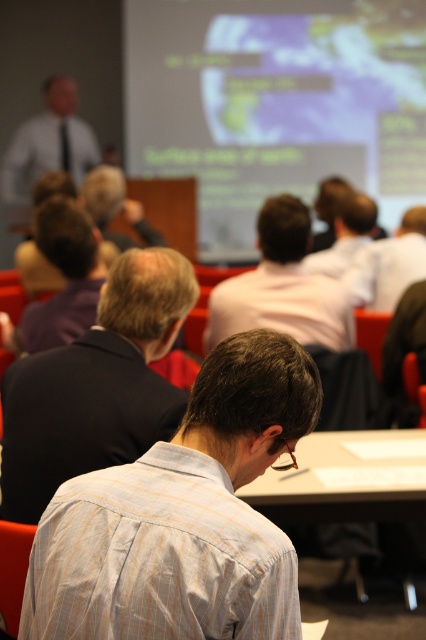
Question: Can you confirm if light blue striped shirt at center is thinner than white shirt at left?

Choices:
 (A) no
 (B) yes

Answer: (B)

Question: Estimate the real-world distances between objects in this image. Which object is closer to the light brown shirt at center?

Choices:
 (A) matte purple shirt at left
 (B) matte projector screen at upper center

Answer: (A)

Question: Which object is the farthest from the white shirt at upper center?

Choices:
 (A) matte purple shirt at left
 (B) white shirt at left

Answer: (B)

Question: Is white shirt at left wider than matte black shirt at center?

Choices:
 (A) yes
 (B) no

Answer: (A)

Question: Among these points, which one is farthest from the camera?

Choices:
 (A) (129, 220)
 (B) (403, 499)
 (C) (68, 448)
 (D) (331, 285)

Answer: (A)

Question: Can you confirm if white paper at center is positioned to the right of matte white shirt at center?

Choices:
 (A) no
 (B) yes

Answer: (A)